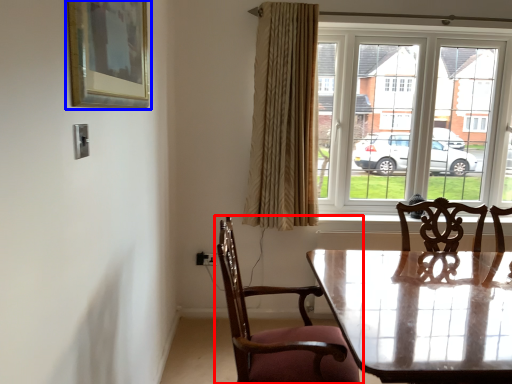
Question: Which point is further to the camera, chair (highlighted by a red box) or picture frame (highlighted by a blue box)?

Choices:
 (A) chair
 (B) picture frame

Answer: (A)